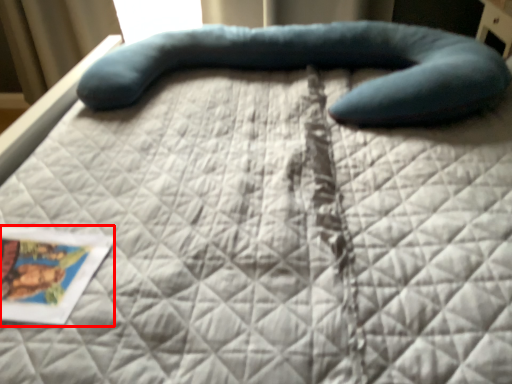
Question: Observing the image, what is the correct spatial positioning of postcard (annotated by the red box) in reference to bean bag chair?

Choices:
 (A) left
 (B) right

Answer: (A)